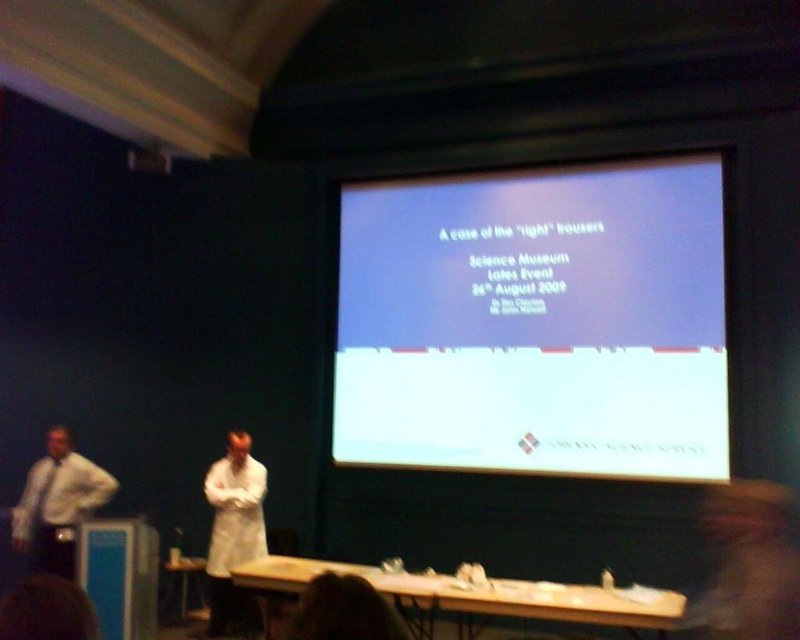
Question: Can you confirm if white lab coat at center is thinner than white shirt at left?

Choices:
 (A) no
 (B) yes

Answer: (B)

Question: Considering the real-world distances, which object is farthest from the white lab coat at center?

Choices:
 (A) white shirt at left
 (B) white matte projection screen at upper center

Answer: (B)

Question: Does white matte projection screen at upper center appear under white lab coat at center?

Choices:
 (A) no
 (B) yes

Answer: (A)

Question: Which point is farther to the camera?

Choices:
 (A) white lab coat at center
 (B) white shirt at left
 (C) white matte projection screen at upper center

Answer: (C)

Question: Does white matte projection screen at upper center appear under white shirt at left?

Choices:
 (A) yes
 (B) no

Answer: (B)

Question: Which object is farther from the camera taking this photo?

Choices:
 (A) white matte projection screen at upper center
 (B) white lab coat at center

Answer: (A)